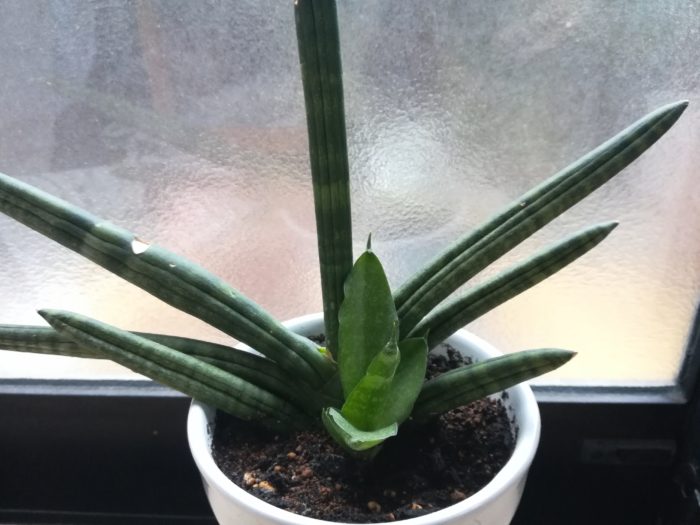
You are a GUI agent. You are given a task and a screenshot of the screen. Output one action in this format:
    pyautogui.click(x=<x>, y=<y>)
    Task: Click on the planter
    
    Given the screenshot: What is the action you would take?
    pyautogui.click(x=237, y=493)